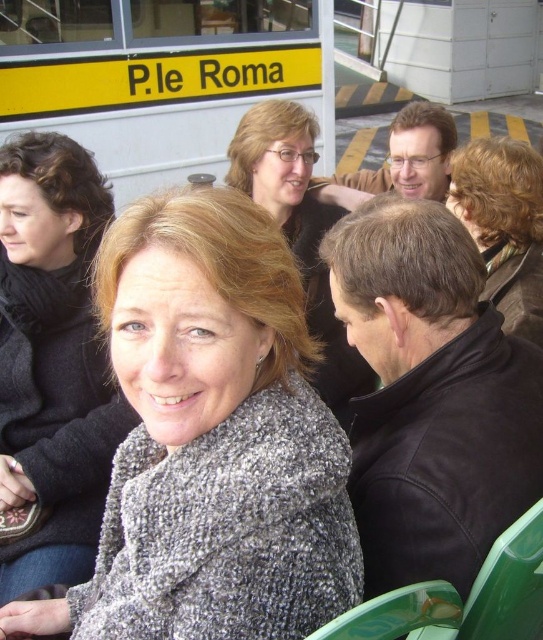
Does gray knitted shawl at center appear under gray textured scarf at center?

Yes, gray knitted shawl at center is below gray textured scarf at center.

Does gray knitted shawl at center come in front of gray textured scarf at center?

Yes, gray knitted shawl at center is in front of gray textured scarf at center.

This screenshot has height=640, width=543. I want to click on gray knitted shawl at center, so (x=211, y=440).

Is point (274, 115) behind point (510, 252)?

Yes, point (274, 115) is farther from viewer.

The height and width of the screenshot is (640, 543). What do you see at coordinates (299, 230) in the screenshot?
I see `smooth black jacket at center` at bounding box center [299, 230].

Is point (302, 115) farther from viewer compared to point (513, 216)?

Yes, point (302, 115) is behind point (513, 216).

The image size is (543, 640). What are the coordinates of `smooth black jacket at center` in the screenshot? It's located at (299, 230).

Is point (27, 465) positioned before point (342, 326)?

Yes, point (27, 465) is closer to viewer.

Who is more forward, (41, 564) or (344, 364)?

Point (41, 564) is more forward.

Is point (22, 419) in front of point (306, 300)?

Yes, point (22, 419) is closer to viewer.

Identify the location of gray textured scarf at center. Image resolution: width=543 pixels, height=640 pixels. (53, 362).